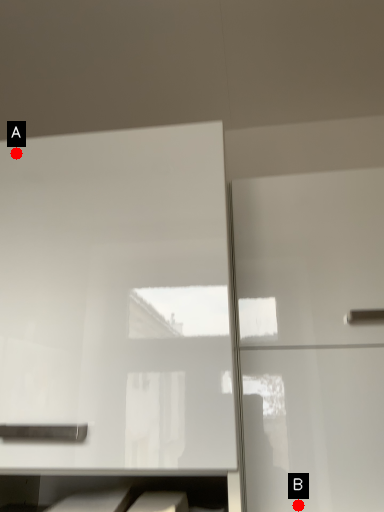
Question: Two points are circled on the image, labeled by A and B beside each circle. Which point is closer to the camera?

Choices:
 (A) A is closer
 (B) B is closer

Answer: (B)